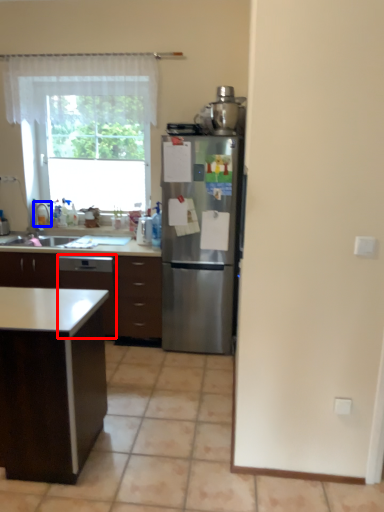
Question: Which point is closer to the camera, dish washer (highlighted by a red box) or faucet (highlighted by a blue box)?

Choices:
 (A) dish washer
 (B) faucet

Answer: (A)